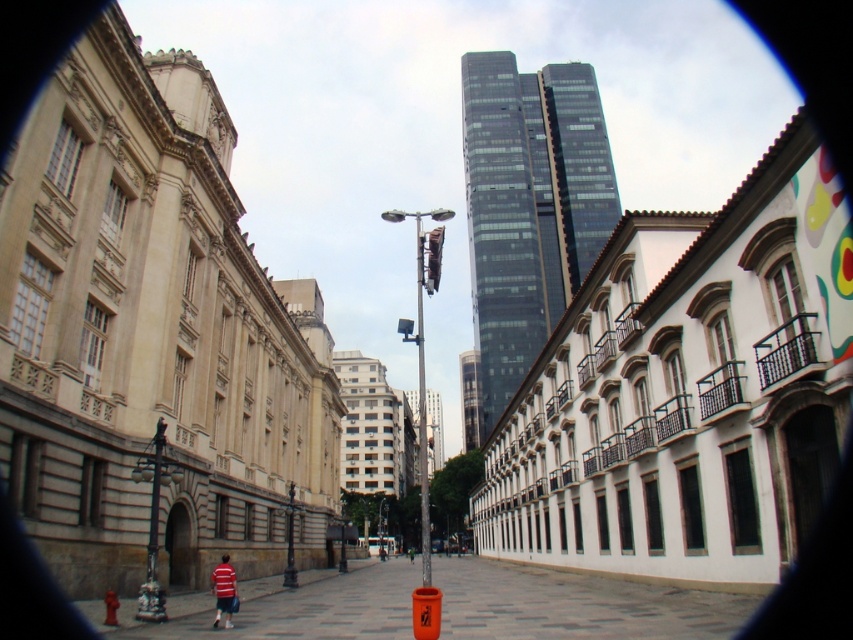
Question: Is polished stone pavement at lower center further to the viewer compared to orange plastic traffic cone at center?

Choices:
 (A) yes
 (B) no

Answer: (B)

Question: Based on their relative distances, which object is farther from the green fabric jacket at center?

Choices:
 (A) orange plastic traffic cone at center
 (B) striped cotton shirt at lower left

Answer: (A)

Question: Which point appears closest to the camera in this image?

Choices:
 (A) (223, 580)
 (B) (410, 557)
 (C) (633, 625)
 (D) (112, 618)

Answer: (C)

Question: Where is polished stone pavement at lower center located in relation to green fabric jacket at center in the image?

Choices:
 (A) right
 (B) left

Answer: (A)

Question: Among these points, which one is nearest to the camera?

Choices:
 (A) (601, 604)
 (B) (111, 598)
 (C) (229, 580)
 (D) (409, 556)

Answer: (B)

Question: Does polished stone pavement at lower center appear under green fabric jacket at center?

Choices:
 (A) no
 (B) yes

Answer: (A)